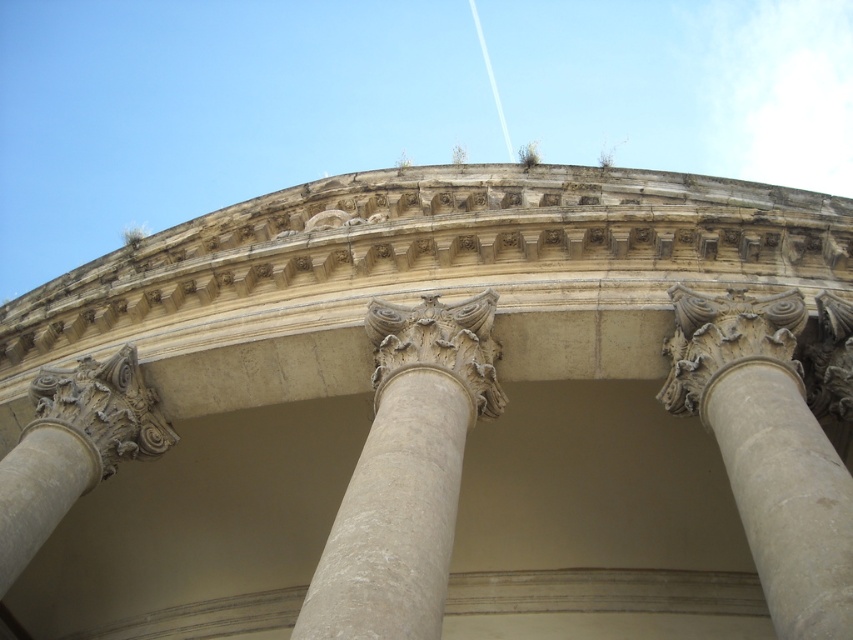
Can you confirm if white stone column at center is positioned above white stone column at right?

Incorrect, white stone column at center is not positioned above white stone column at right.

Is point (407, 444) positioned before point (746, 493)?

No, it is not.

The image size is (853, 640). I want to click on white stone column at center, so click(x=405, y=474).